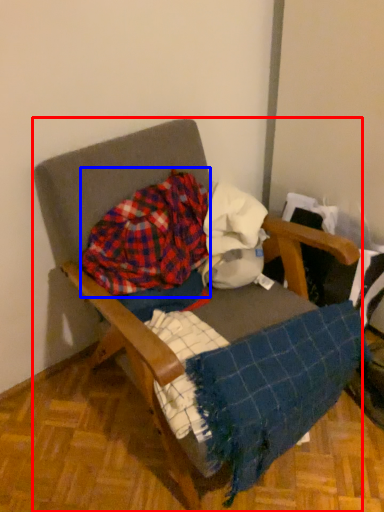
Question: Which of the following is the closest to the observer, furniture (highlighted by a red box) or flannel (highlighted by a blue box)?

Choices:
 (A) furniture
 (B) flannel

Answer: (A)